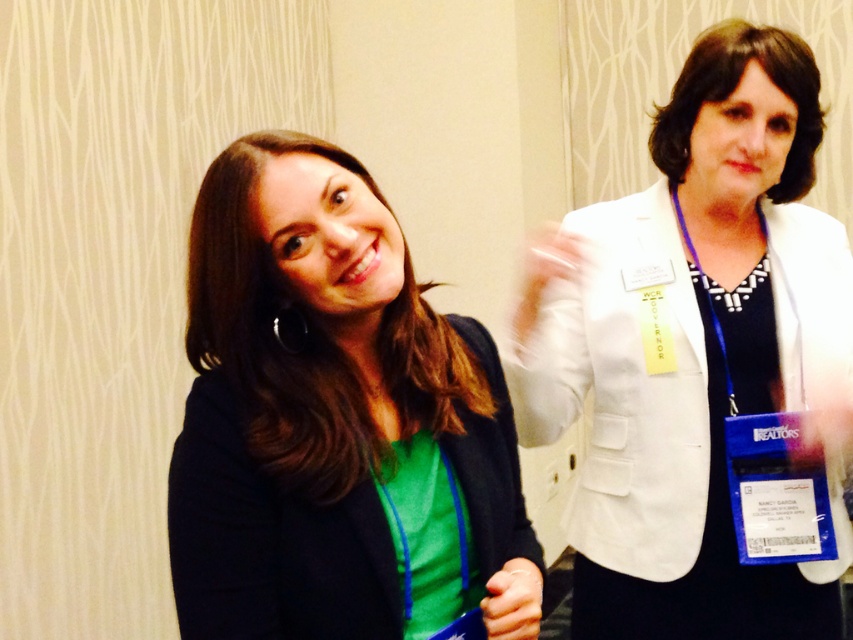
Does white matte blazer at upper right have a lesser width compared to translucent plastic hand at upper center?

No.

Consider the image. Is white matte blazer at upper right bigger than translucent plastic hand at upper center?

Yes, white matte blazer at upper right is bigger than translucent plastic hand at upper center.

The image size is (853, 640). Find the location of `white matte blazer at upper right`. white matte blazer at upper right is located at coordinates (698, 353).

Where is `white matte blazer at upper right`? white matte blazer at upper right is located at coordinates (698, 353).

The width and height of the screenshot is (853, 640). Describe the element at coordinates (329, 416) in the screenshot. I see `matte black blazer at center` at that location.

In order to click on matte black blazer at center in this screenshot , I will do `click(329, 416)`.

Which of these two, white matte blazer at upper right or smooth skin hand at lower center, stands shorter?

smooth skin hand at lower center

Which is in front, point (675, 390) or point (512, 614)?

Point (512, 614)

Is point (711, 225) farther from camera compared to point (508, 636)?

Yes, point (711, 225) is farther from viewer.

The height and width of the screenshot is (640, 853). Find the location of `white matte blazer at upper right`. white matte blazer at upper right is located at coordinates (698, 353).